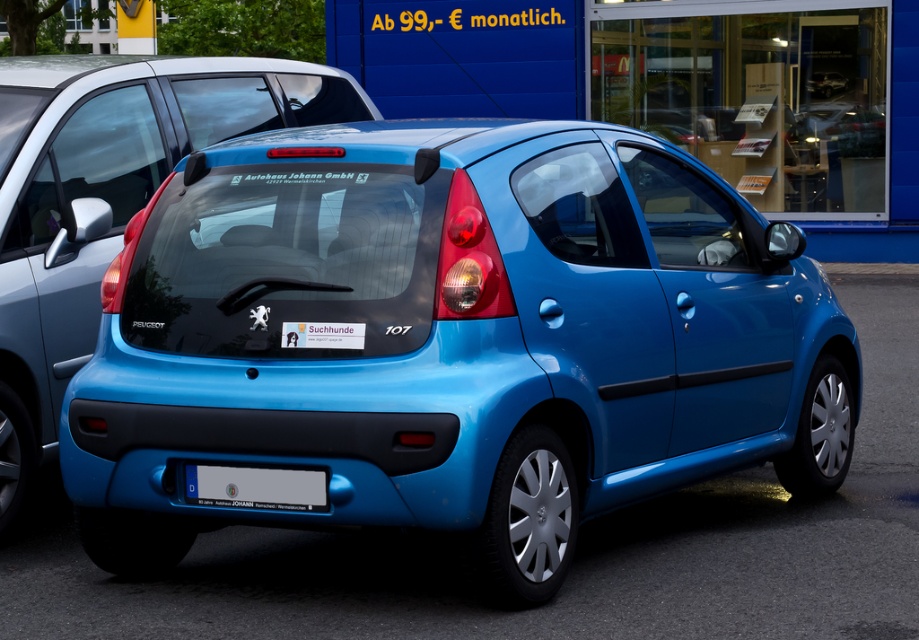
Question: Which of the following is the farthest from the observer?

Choices:
 (A) (237, 388)
 (B) (0, 252)

Answer: (B)

Question: Is matte blue car at center bigger than matte black minivan at left?

Choices:
 (A) no
 (B) yes

Answer: (B)

Question: Does matte blue car at center appear on the right side of white plastic license plate at center?

Choices:
 (A) no
 (B) yes

Answer: (B)

Question: Which point is closer to the camera?

Choices:
 (A) (214, 483)
 (B) (269, 99)
 (C) (469, 145)

Answer: (A)

Question: Estimate the real-world distances between objects in this image. Which object is closer to the matte blue car at center?

Choices:
 (A) white plastic license plate at center
 (B) matte black minivan at left

Answer: (A)

Question: Can you confirm if matte black minivan at left is wider than white plastic license plate at center?

Choices:
 (A) no
 (B) yes

Answer: (B)